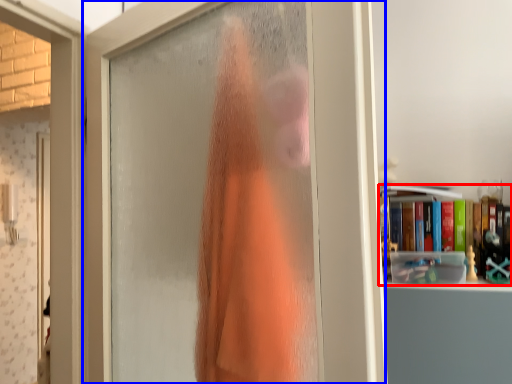
Question: Which object appears closest to the camera in this image, book (highlighted by a red box) or door (highlighted by a blue box)?

Choices:
 (A) book
 (B) door

Answer: (B)